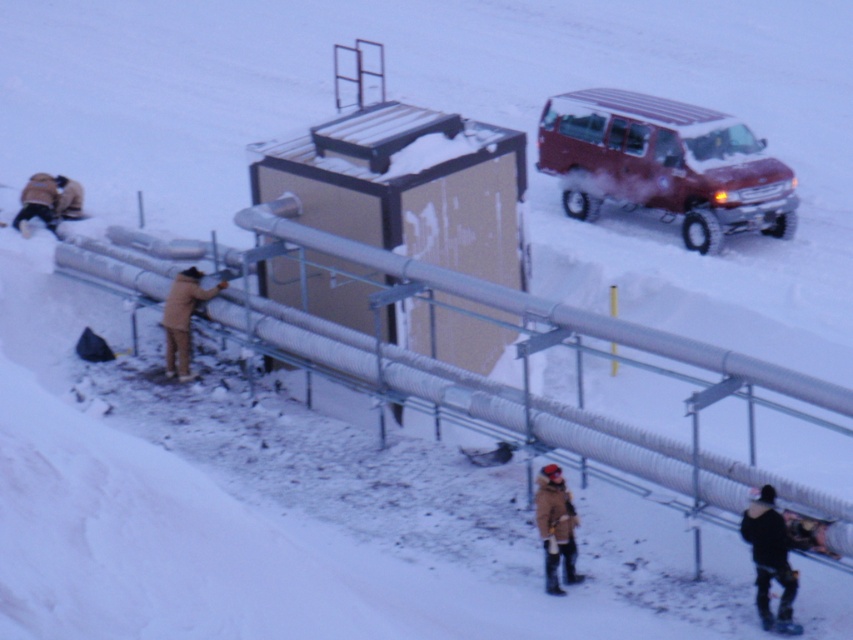
You are a photographer trying to capture a group photo of the two people in the snowy scene. The people are wearing a dark gray jacket at lower right and a brown woolen jacket at left. To ensure both are in the frame, should you position yourself to the left or right of the two jackets?

You should position yourself to the left of the two jackets because the dark gray jacket at lower right is to the right of the brown woolen jacket at left. This way, both will be visible in the frame when you take the photo.

You are standing at the camera position and need to locate the dark gray jacket at lower right. According to the coordinates provided, where exactly is it positioned?

The dark gray jacket at lower right is located at point 0.875 on the x axis and 0.904 on the y axis.

You are a delivery driver who needs to park your matte red van at upper right in a space that can only accommodate vehicles narrower than the beige wool jacket at lower left. Can your van fit?

The matte red van at upper right is wider than the beige wool jacket at lower left, so it cannot fit in the space.